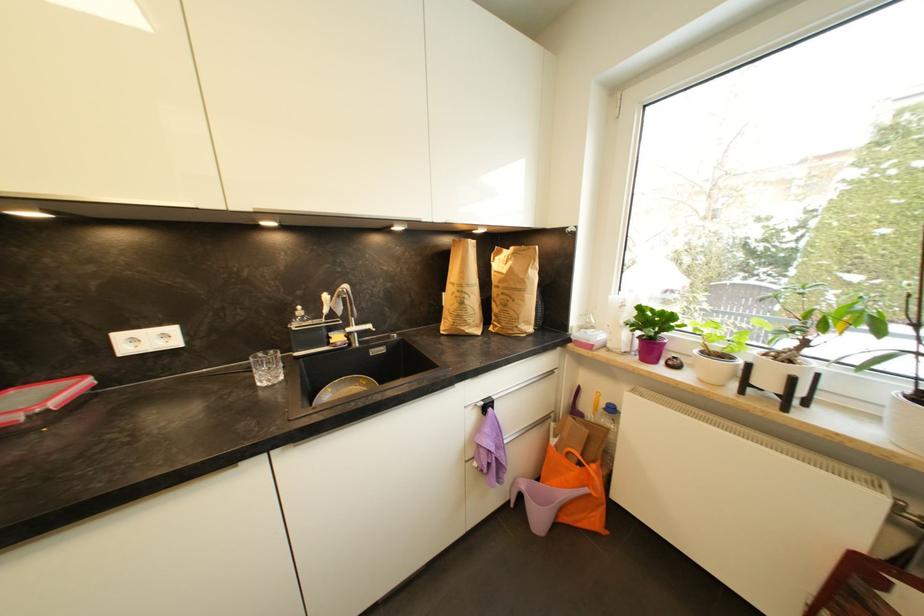
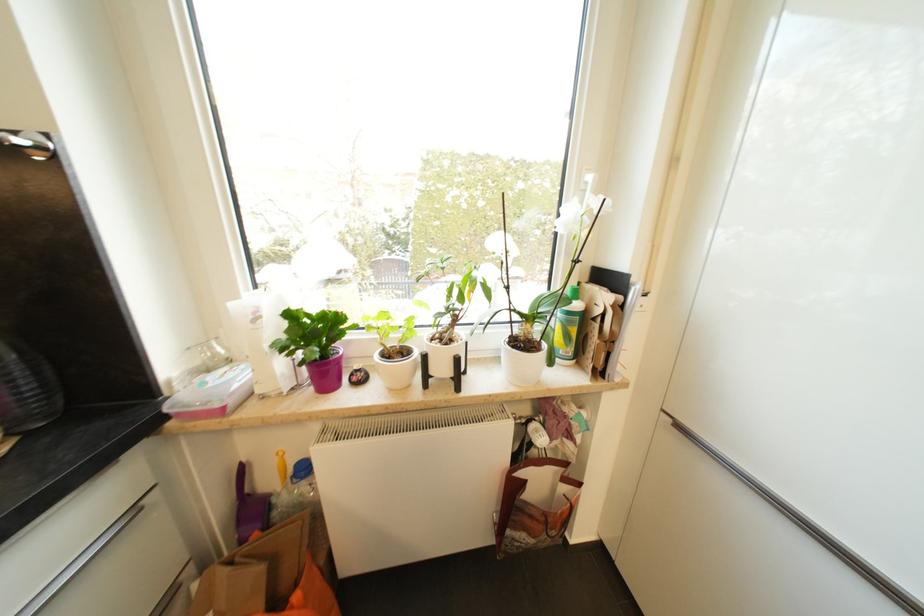
In the second image, find the point that corresponds to point 700,353 in the first image.

(381, 358)